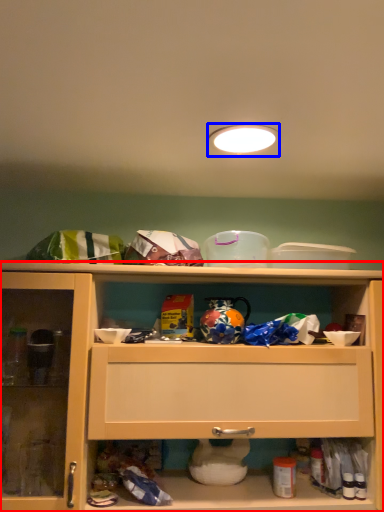
Question: Among these objects, which one is nearest to the camera, cabinetry (highlighted by a red box) or lighting (highlighted by a blue box)?

Choices:
 (A) cabinetry
 (B) lighting

Answer: (B)